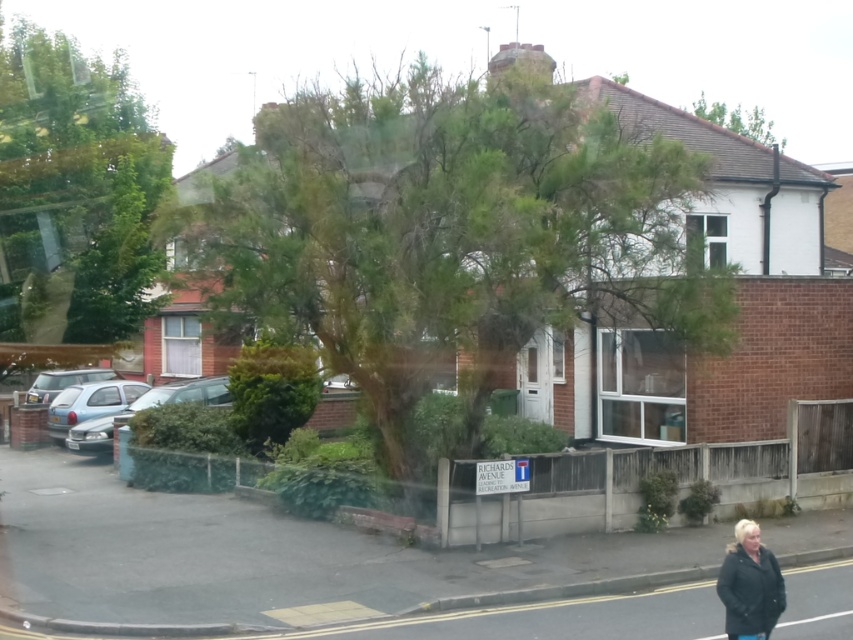
Question: Which of these objects is positioned farthest from the silver metallic car at left?

Choices:
 (A) dark gray jacket at lower right
 (B) green leafy tree at upper left
 (C) silver metallic car at lower left
 (D) light blue metallic hatchback at left

Answer: (A)

Question: Is green leafy tree at center wider than dark gray jacket at lower right?

Choices:
 (A) yes
 (B) no

Answer: (A)

Question: Where is green leafy tree at center located in relation to dark gray jacket at lower right in the image?

Choices:
 (A) right
 (B) left

Answer: (B)

Question: Is green leafy tree at upper left bigger than light blue metallic hatchback at left?

Choices:
 (A) no
 (B) yes

Answer: (B)

Question: Among these objects, which one is nearest to the camera?

Choices:
 (A) green leafy tree at upper left
 (B) green leafy tree at upper center
 (C) green leafy tree at center

Answer: (C)

Question: Which point is farther from the camera taking this photo?

Choices:
 (A) (750, 579)
 (B) (113, 394)
 (C) (753, 115)
 (D) (637, 310)

Answer: (C)